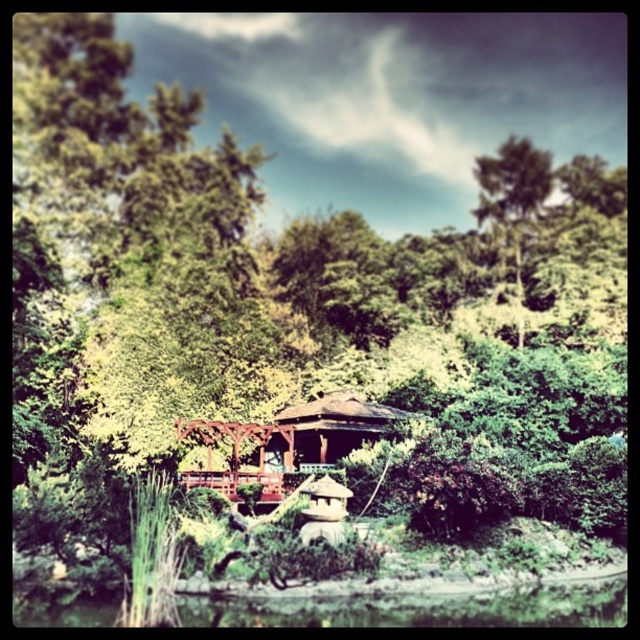
Question: Estimate the real-world distances between objects in this image. Which object is farther from the green grassy river at lower center?

Choices:
 (A) green leafy tree at upper right
 (B) wooden gazebo at center

Answer: (A)

Question: Does wooden gazebo at center have a smaller size compared to green leafy tree at upper right?

Choices:
 (A) yes
 (B) no

Answer: (A)

Question: Is wooden gazebo at center positioned at the back of green leafy tree at upper right?

Choices:
 (A) no
 (B) yes

Answer: (A)

Question: Among these points, which one is farthest from the camera?

Choices:
 (A) (531, 168)
 (B) (540, 616)
 (C) (228, 428)

Answer: (A)

Question: Among these objects, which one is nearest to the camera?

Choices:
 (A) green grassy river at lower center
 (B) green leafy tree at upper right
 (C) wooden gazebo at center

Answer: (A)

Question: Can you confirm if green grassy river at lower center is positioned below wooden gazebo at center?

Choices:
 (A) yes
 (B) no

Answer: (A)